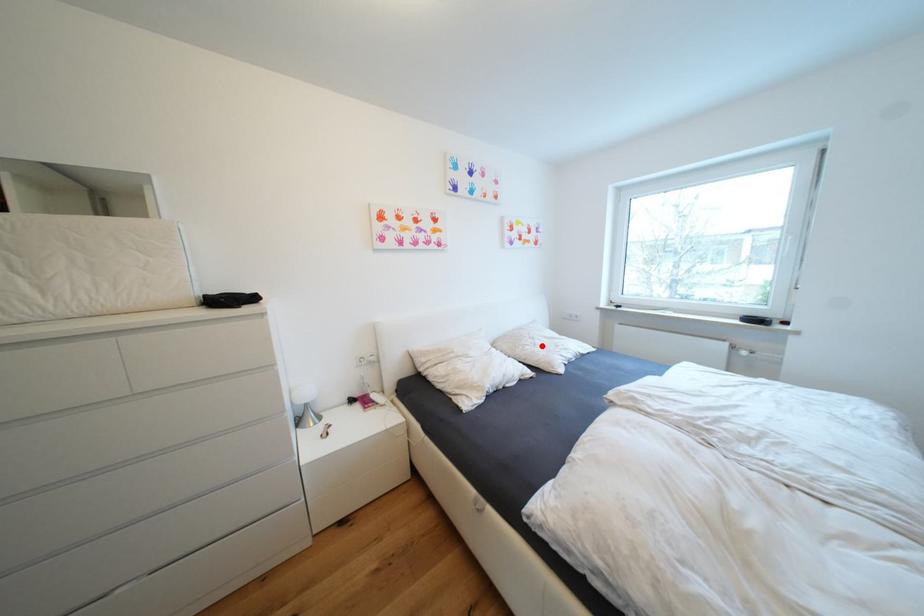
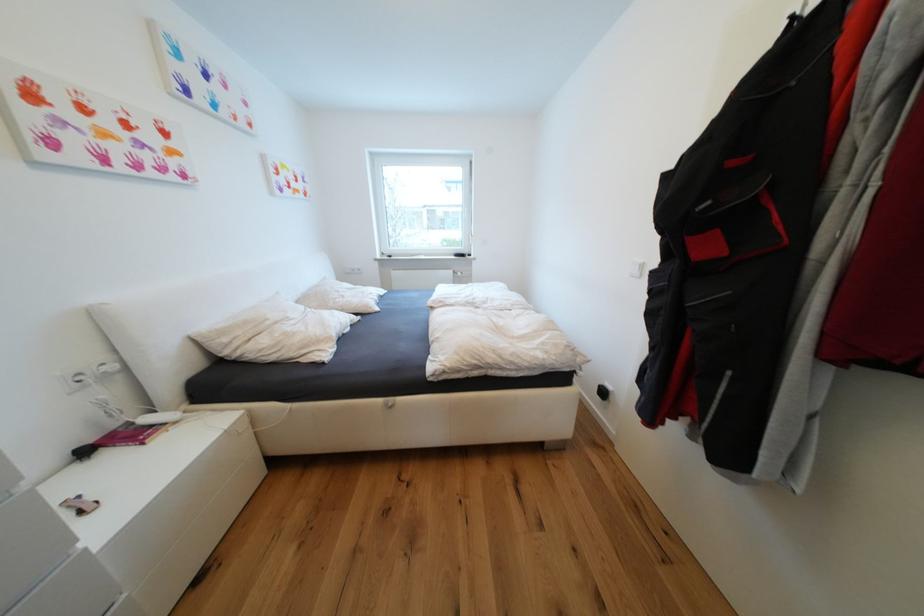
Find the pixel in the second image that matches the highlighted location in the first image.

(349, 297)